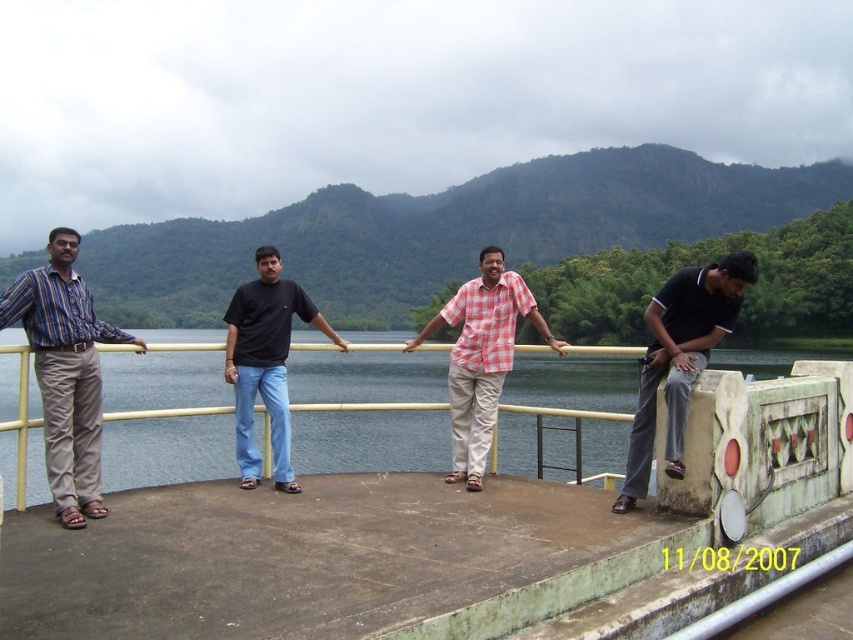
You are standing on the platform and looking at the clear water at center and the black cotton shirt at center. Which one is taller?

The clear water at center is taller than the black cotton shirt at center.

You are trying to decide which person to approach for a conversation based on their clothing. The striped cotton shirt at left and the checkered fabric shirt at center are both visible. Which person has a wider shirt?

The striped cotton shirt at left is wider than the checkered fabric shirt at center, so you should approach the person wearing the striped cotton shirt at left if you want to talk to someone with a wider shirt.